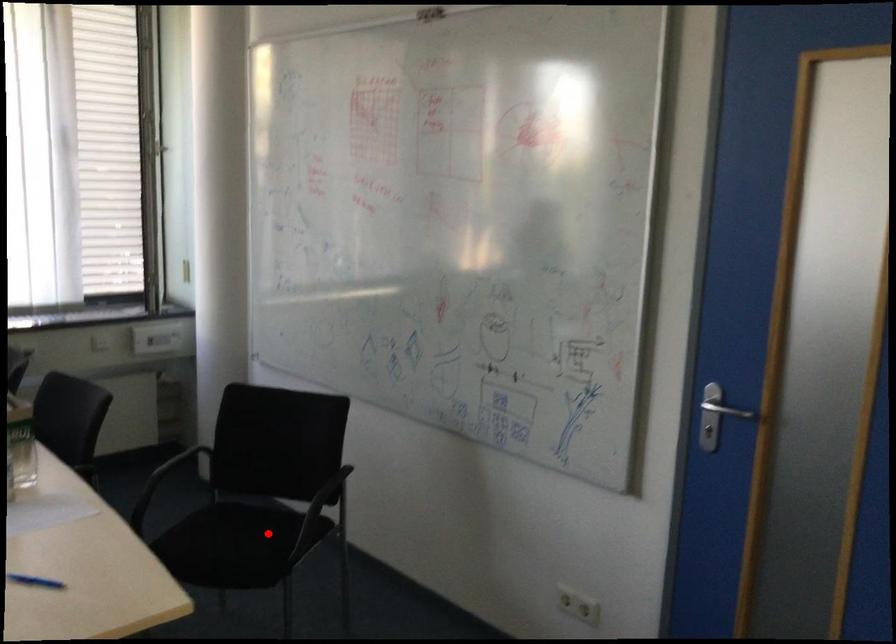
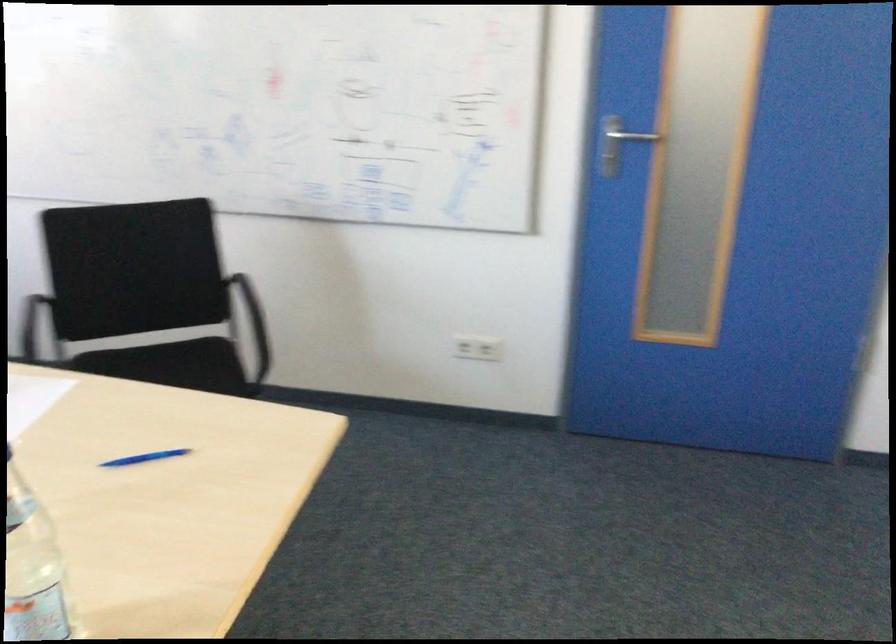
Question: I am providing you with two images of the same scene from different viewpoints. Given a red point in image1, look at the same physical point in image2. Is it:

Choices:
 (A) Closer to the viewpoint
 (B) Farther from the viewpoint

Answer: (A)